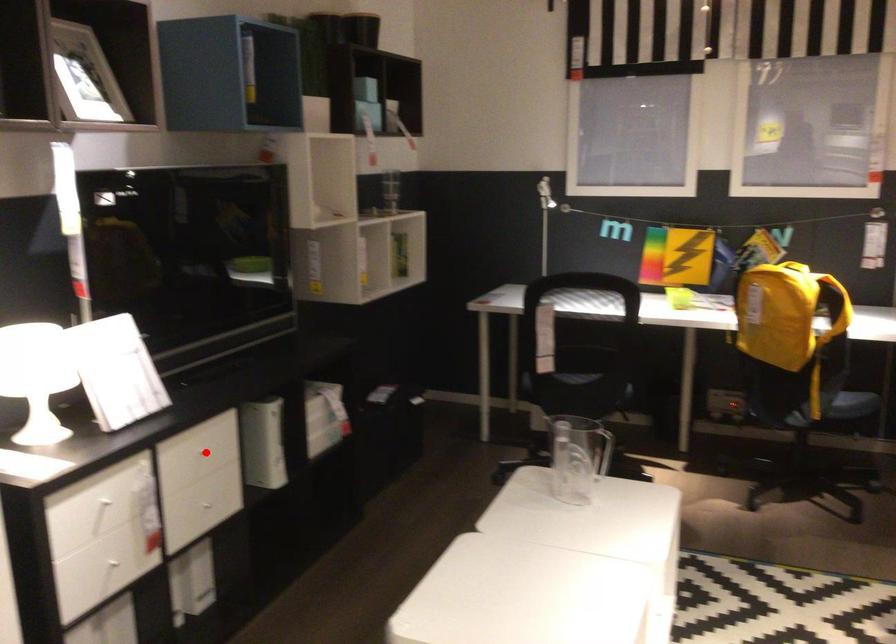
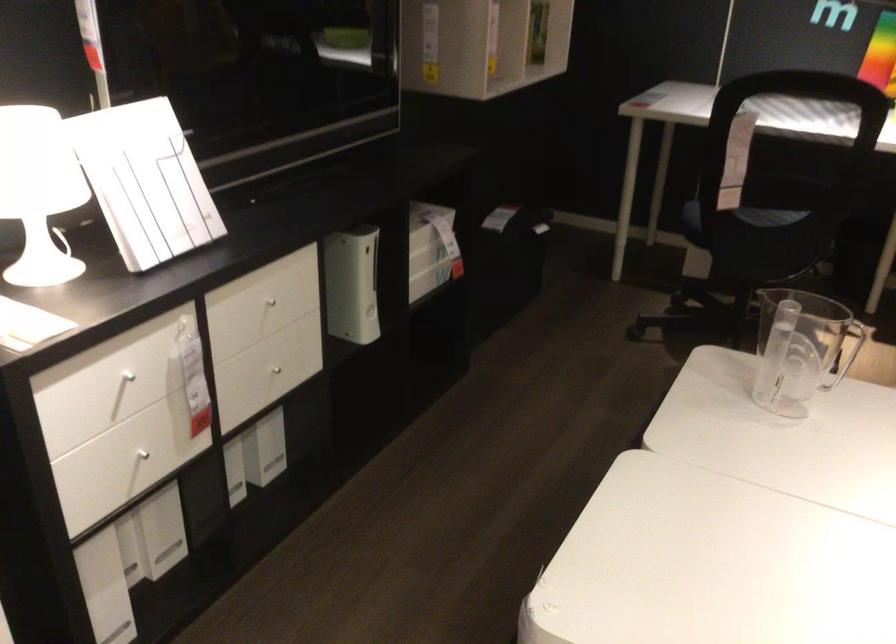
Question: A red point is marked in image1. In image2, is the corresponding 3D point closer to the camera or farther? Reply with the corresponding letter.

Choices:
 (A) The corresponding 3D point is closer.
 (B) The corresponding 3D point is farther.

Answer: (A)